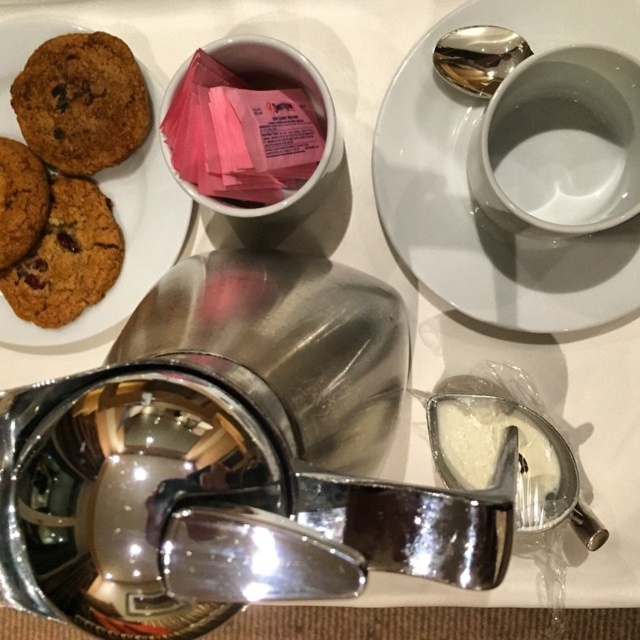
You are sitting at the table and want to reach both the cookie plate and the cup with sugar packets. Which item is closer to you, the cookie plate at point (10, 145) or the cup with sugar packets at point (108, 312)?

The cup with sugar packets at point (108, 312) is closer to you than the cookie plate at point (10, 145) because point (108, 312) is further to the viewer than point (10, 145).

You are holding a 10 inch wide book and want to place it on the table without covering any existing items. The table has a white surface with a small white plate of cookies at upper left, a white cup with pink packets to the right of the cookies, and another white plate at point (499,141). Can you fit your book on the table without overlapping any of these items?

The point (499,141) is 20.97 inches away from the camera. Since the book is only 10 inches wide, there should be enough space on the table to place it without overlapping the existing items as long as it is positioned appropriately away from the plates and cup.

Consider the image. You are standing at the viewer position and want to pick up the object at point (x=13, y=44). Can you reach it without moving your position?

The point (x=13, y=44) is 22.61 inches away from the viewer, so yes, you can reach it without moving your position if your arm can extend that far.